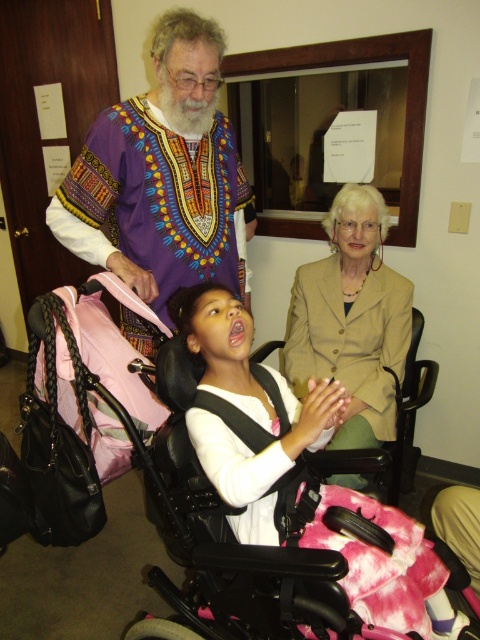
Does purple printed shirt at upper left have a lesser width compared to beige fabric jacket at center?

No.

This screenshot has height=640, width=480. Identify the location of purple printed shirt at upper left. (160, 173).

This screenshot has height=640, width=480. Describe the element at coordinates (160, 173) in the screenshot. I see `purple printed shirt at upper left` at that location.

Locate an element on the screen. purple printed shirt at upper left is located at coordinates 160,173.

Is pink fabric baby carriage at lower center below beige fabric jacket at center?

Yes, pink fabric baby carriage at lower center is below beige fabric jacket at center.

Find the location of a particular element. The width and height of the screenshot is (480, 640). pink fabric baby carriage at lower center is located at coordinates (311, 486).

Is the position of pink fabric baby carriage at lower center more distant than that of purple printed shirt at upper left?

A: No, it is in front of purple printed shirt at upper left.

Can you confirm if pink fabric baby carriage at lower center is shorter than purple printed shirt at upper left?

Indeed, pink fabric baby carriage at lower center has a lesser height compared to purple printed shirt at upper left.

Where is `pink fabric baby carriage at lower center`? This screenshot has height=640, width=480. pink fabric baby carriage at lower center is located at coordinates (311, 486).